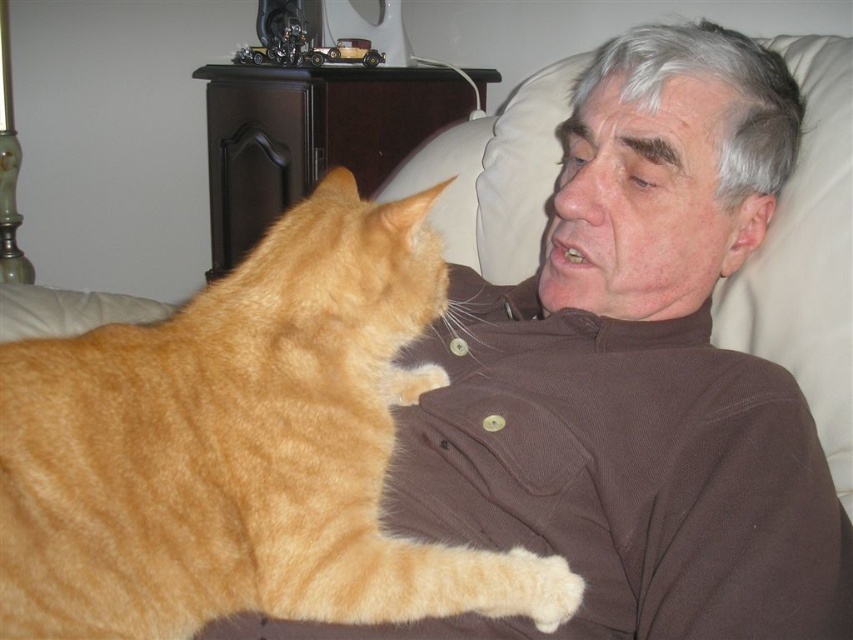
You are a photographer setting up a camera to take a portrait of the elderly man and the ginger cat. The camera is positioned to focus on the man, but you want to ensure the orange fur cat at upper left and the white soft pillow at upper right are both visible in the frame. Based on their sizes, which object should you adjust the camera angle to emphasize more?

The orange fur cat at upper left is not as tall as the white soft pillow at upper right, so to emphasize the pillow, you can adjust the camera angle to focus slightly upward towards the pillow. Alternatively, to highlight the cat, lower the angle since it is smaller.

You are a delivery person who needs to place a small package on the brown corduroy shirt at upper right. The package is 12 inches in length. Can you estimate if the shirt will fit the package?

The brown corduroy shirt at upper right is 26.50 inches away from the viewer. Since the package is only 12 inches long, the distance does not affect the package size. The shirt itself is likely large enough to accommodate the package unless the shirt is smaller than 12 inches in any dimension, but the description does not provide the shirt size. However, based on typical shirt sizes, it should fit.